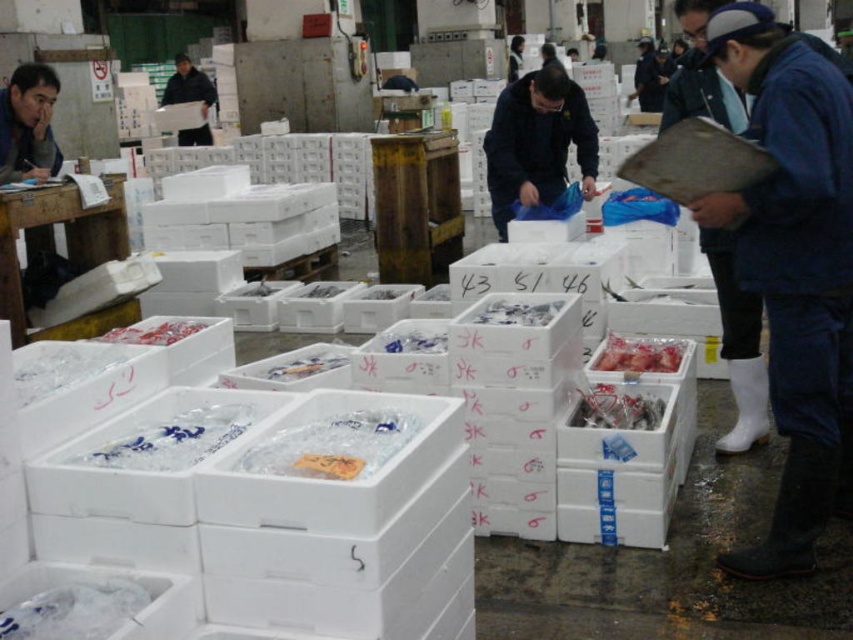
Question: Which point is farther from the camera taking this photo?

Choices:
 (A) (782, 144)
 (B) (498, 227)
 (C) (180, 97)

Answer: (C)

Question: Which point is closer to the camera taking this photo?

Choices:
 (A) (173, 92)
 (B) (791, 554)

Answer: (B)

Question: Is blue denim jacket at upper right in front of dark blue jacket at center?

Choices:
 (A) no
 (B) yes

Answer: (B)

Question: Is blue denim jacket at upper right to the left of dark blue jacket at center from the viewer's perspective?

Choices:
 (A) no
 (B) yes

Answer: (A)

Question: Which is farther from the blue denim jacket at upper right?

Choices:
 (A) black matte jacket at upper left
 (B) dark blue jacket at center

Answer: (A)

Question: Does blue denim jacket at upper right lie in front of dark blue jacket at center?

Choices:
 (A) yes
 (B) no

Answer: (A)